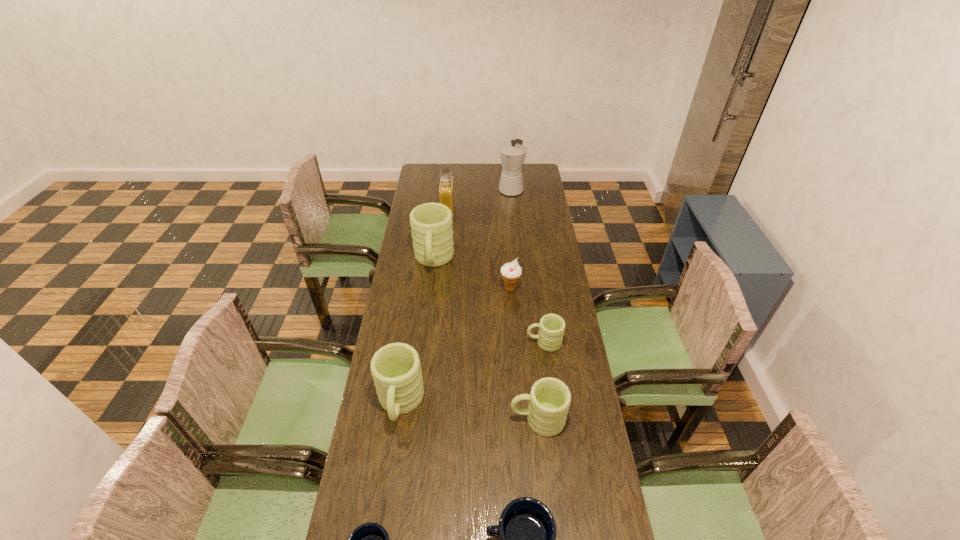
At what (x,y) coordinates should I click in order to perform the action: click on vacant space that's between the tallest object and the tallest mug. Please return your answer as a coordinate pair (x, y). Looking at the image, I should click on (472, 225).

The image size is (960, 540). Find the location of `free spot between the second tallest mug and the farthest object`. free spot between the second tallest mug and the farthest object is located at coordinates [456, 296].

Identify the location of blank region between the perfume and the gray coffeepot. This screenshot has width=960, height=540. (479, 200).

Where is `vacant point located between the third biggest green mug and the farthest green mug`? vacant point located between the third biggest green mug and the farthest green mug is located at coordinates (486, 340).

I want to click on free point between the second smallest green mug and the fourth farthest object, so click(524, 354).

Identify which object is located as the nearest to the seventh nearest object. Please provide its 2D coordinates. Your answer should be formatted as a tuple, i.e. [(x, y)], where the tuple contains the x and y coordinates of a point satisfying the conditions above.

[(446, 186)]

Where is `the eighth closest object to the farthest object`? This screenshot has height=540, width=960. the eighth closest object to the farthest object is located at coordinates (370, 539).

The height and width of the screenshot is (540, 960). I want to click on the fourth closest mug to the perfume, so (x=549, y=400).

The image size is (960, 540). I want to click on mug that is the fourth closest to the fifth nearest object, so click(x=526, y=531).

Find the location of a particular element. The image size is (960, 540). green mug that is the fourth closest to the eighth nearest object is located at coordinates (549, 400).